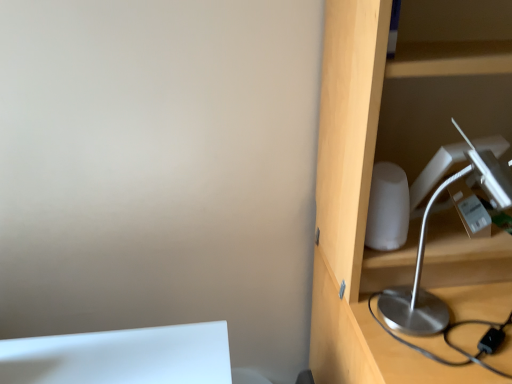
What are the coordinates of `silver metallic lamp at right` in the screenshot? It's located at (423, 258).

What do you see at coordinates (423, 258) in the screenshot?
I see `silver metallic lamp at right` at bounding box center [423, 258].

Identify the location of silver metallic lamp at right. (423, 258).